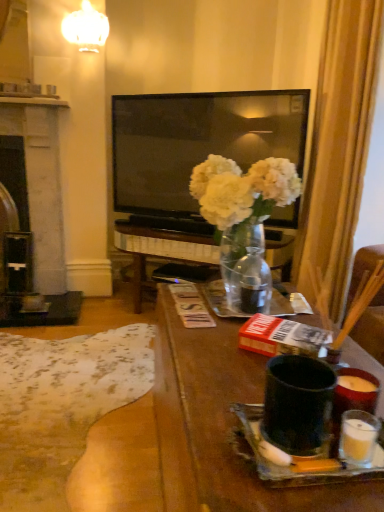
The width and height of the screenshot is (384, 512). Identify the location of black stone fireplace at left. (41, 195).

The width and height of the screenshot is (384, 512). What do you see at coordinates (41, 195) in the screenshot? I see `black stone fireplace at left` at bounding box center [41, 195].

Image resolution: width=384 pixels, height=512 pixels. Find the location of `translucent glass vase at center`. translucent glass vase at center is located at coordinates (243, 219).

From the image's perspective, is silky gold curtain at right on black stone fireplace at left?

Yes, from the image's perspective, silky gold curtain at right is on top of black stone fireplace at left.

Does point (317, 125) appear closer or farther from the camera than point (8, 127)?

Point (317, 125) is closer to the camera than point (8, 127).

Locate an element on the screen. This screenshot has height=512, width=384. curtain above the black stone fireplace at left (from the image's perspective) is located at coordinates (339, 147).

Is translucent glass vase at center oriented away from black stone fireplace at left?

translucent glass vase at center is not turned away from black stone fireplace at left.

Can you see translucent glass vase at center touching black stone fireplace at left?

No, translucent glass vase at center is not beside black stone fireplace at left.

Is translucent glass vase at center taller than black stone fireplace at left?

No.

Between matte black mug at center and black stone fireplace at left, which one is positioned behind?

Positioned behind is black stone fireplace at left.

Considering the relative positions of matte black mug at center and black stone fireplace at left in the image provided, is matte black mug at center to the left or to the right of black stone fireplace at left?

Based on their positions, matte black mug at center is located to the right of black stone fireplace at left.

Where is `fireplace to the left of matte black mug at center`? Image resolution: width=384 pixels, height=512 pixels. fireplace to the left of matte black mug at center is located at coordinates (41, 195).

Is matte black mug at center touching black stone fireplace at left?

No.

Is black stone fireplace at left behind translucent glass vase at center?

Yes, black stone fireplace at left is further from the viewer.

Visually, is black stone fireplace at left positioned to the left or to the right of translucent glass vase at center?

black stone fireplace at left is to the left of translucent glass vase at center.

Which of these two, black stone fireplace at left or translucent glass vase at center, is smaller?

With smaller size is translucent glass vase at center.

From a real-world perspective, who is located higher, black stone fireplace at left or translucent glass vase at center?

translucent glass vase at center is physically above.

Identify the location of curtain located on the right of translucent glass vase at center. (339, 147).

Is translucent glass vase at center aimed at silky gold curtain at right?

No.

Can you tell me how much translucent glass vase at center and silky gold curtain at right differ in facing direction?

The facing directions of translucent glass vase at center and silky gold curtain at right are 1.62 degrees apart.

What's the angular difference between translucent glass vase at center and white glossy lampshade at upper center's facing directions?

92 degrees.

From a real-world perspective, which is physically above, translucent glass vase at center or white glossy lampshade at upper center?

white glossy lampshade at upper center.

I want to click on floral arrangement that is on the right side of white glossy lampshade at upper center, so click(x=243, y=219).

Is translucent glass vase at center aimed at white glossy lampshade at upper center?

No.

Is black stone fireplace at left in front of or behind silky gold curtain at right in the image?

black stone fireplace at left is behind silky gold curtain at right.

How different are the orientations of black stone fireplace at left and silky gold curtain at right in degrees?

91 degrees separate the facing orientations of black stone fireplace at left and silky gold curtain at right.

Is black stone fireplace at left bigger or smaller than silky gold curtain at right?

In the image, black stone fireplace at left appears to be smaller than silky gold curtain at right.

In the scene shown: From the image's perspective, is black stone fireplace at left above silky gold curtain at right?

Incorrect, from the image's perspective, black stone fireplace at left is lower than silky gold curtain at right.

Locate an element on the screen. curtain lying above the black stone fireplace at left (from the image's perspective) is located at coordinates (339, 147).

What are the coordinates of `floral arrangement in front of the black stone fireplace at left` in the screenshot? It's located at (243, 219).

Looking at this image, estimate the real-world distances between objects in this image. Which object is further from translucent glass vase at center, black stone fireplace at left or silky gold curtain at right?

Among the two, black stone fireplace at left is located further to translucent glass vase at center.

Considering their positions, is translucent glass vase at center positioned closer to white glossy lampshade at upper center than matte black mug at center?

Among the two, translucent glass vase at center is located nearer to white glossy lampshade at upper center.

Which object lies further to the anchor point white glossy lampshade at upper center, silky gold curtain at right or matte black mug at center?

The object further to white glossy lampshade at upper center is matte black mug at center.

Based on their spatial positions, is white glossy lampshade at upper center or black stone fireplace at left further from matte black mug at center?

Among the two, white glossy lampshade at upper center is located further to matte black mug at center.

Consider the image. Based on their spatial positions, is white glossy lampshade at upper center or black stone fireplace at left closer to silky gold curtain at right?

white glossy lampshade at upper center lies closer to silky gold curtain at right than the other object.

Based on their spatial positions, is black stone fireplace at left or silky gold curtain at right closer to matte black mug at center?

silky gold curtain at right lies closer to matte black mug at center than the other object.

From the image, which object appears to be farther from black stone fireplace at left, matte black mug at center or translucent glass vase at center?

translucent glass vase at center is further to black stone fireplace at left.

Considering their positions, is silky gold curtain at right positioned closer to matte black mug at center than black stone fireplace at left?

silky gold curtain at right.

Identify the location of curtain located between matte black mug at center and black stone fireplace at left in the depth direction. The image size is (384, 512). (339, 147).

Identify the location of floral arrangement between matte black mug at center and white glossy lampshade at upper center in the front-back direction. (243, 219).

You are a GUI agent. You are given a task and a screenshot of the screen. Output one action in this format:
    pyautogui.click(x=<x>, y=<y>)
    Task: Click on the lamp located between matte black mug at center and black stone fireplace at left in the depth direction
    
    Given the screenshot: What is the action you would take?
    pyautogui.click(x=86, y=28)

At what (x,y) coordinates should I click in order to perform the action: click on curtain located between matte black mug at center and white glossy lampshade at upper center in the depth direction. Please return your answer as a coordinate pair (x, y). The image size is (384, 512). Looking at the image, I should click on (339, 147).